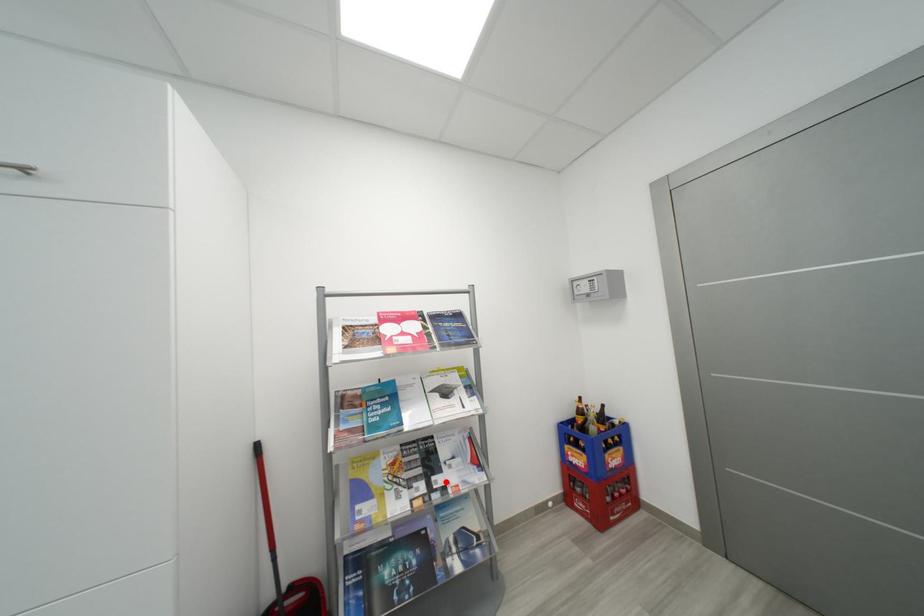
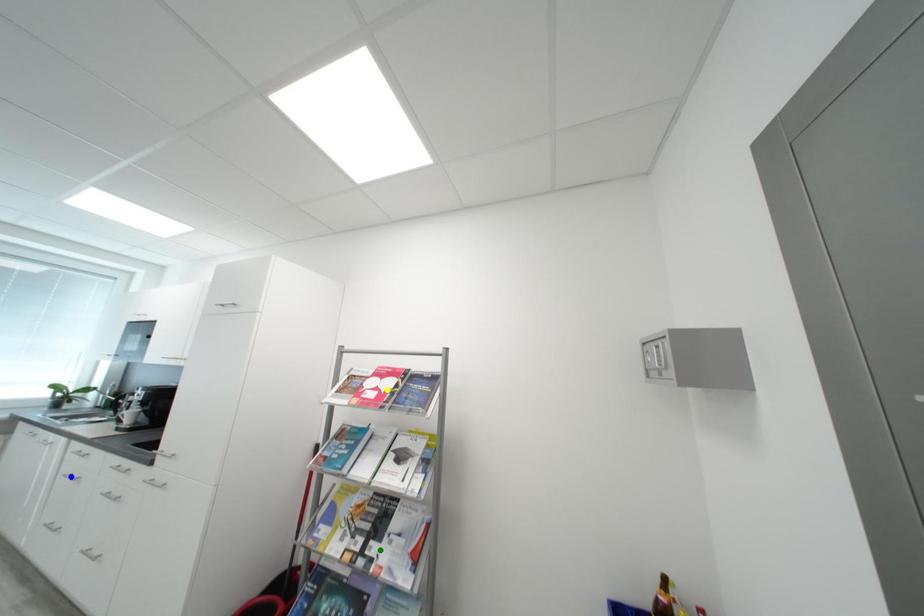
Question: I am providing you with two images of the same scene from different viewpoints. A red point is marked on the first image. You are given multiple points on the second image. Which mark in image 2 goes with the point in image 1?

Choices:
 (A) yellow point
 (B) blue point
 (C) green point

Answer: (C)